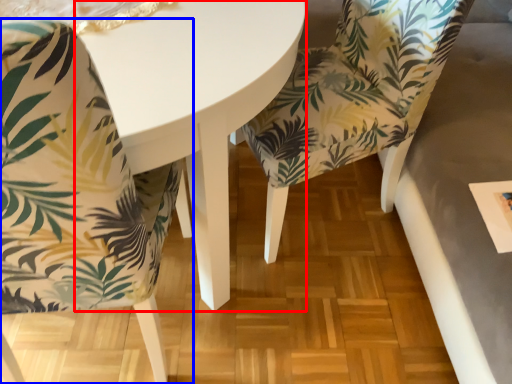
Question: Which object is closer to the camera taking this photo, round table (highlighted by a red box) or chair (highlighted by a blue box)?

Choices:
 (A) round table
 (B) chair

Answer: (B)